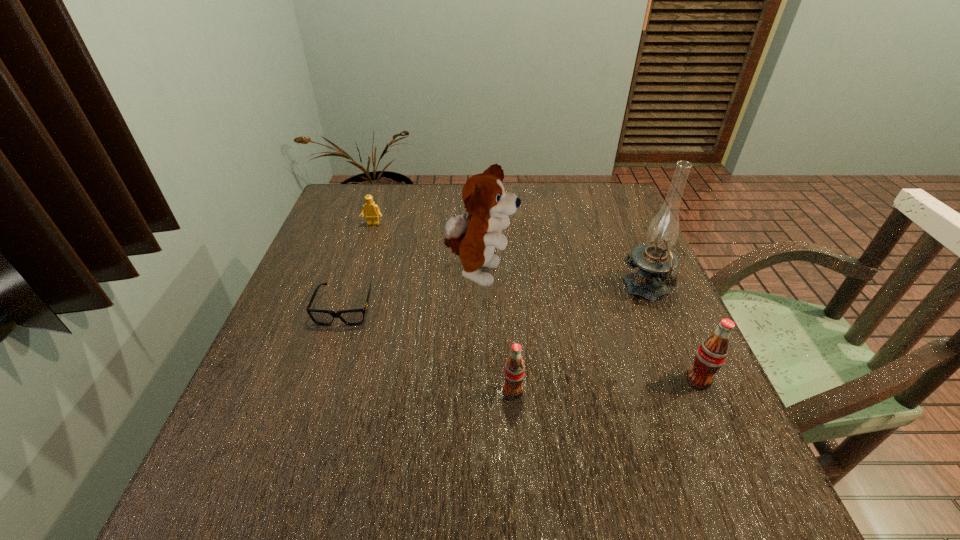
Find the location of a particular element. free region located on the left of the fourth shortest object is located at coordinates click(x=498, y=380).

Find the location of a particular element. The height and width of the screenshot is (540, 960). vacant area situated 0.370m on the face of the farthest object is located at coordinates (342, 321).

At what (x,y) coordinates should I click in order to perform the action: click on free space located on the face of the second tallest object. Please return your answer as a coordinate pair (x, y). This screenshot has height=540, width=960. Looking at the image, I should click on (659, 274).

At what (x,y) coordinates should I click in order to perform the action: click on vacant space located on the front-facing side of the sunglasses. Please return your answer as a coordinate pair (x, y). The image size is (960, 540). Looking at the image, I should click on coord(304,431).

Locate an element on the screen. The image size is (960, 540). free location located on the left of the oil lamp is located at coordinates (485, 290).

Identify the location of object located at the far edge. (372, 212).

The image size is (960, 540). What are the coordinates of `Lego that is at the left edge` in the screenshot? It's located at (372, 212).

Locate an element on the screen. The width and height of the screenshot is (960, 540). sunglasses that is at the left edge is located at coordinates (352, 317).

Find the location of a particular element. soda situated at the right edge is located at coordinates (711, 354).

The height and width of the screenshot is (540, 960). Identify the location of oil lamp that is at the right edge. (657, 263).